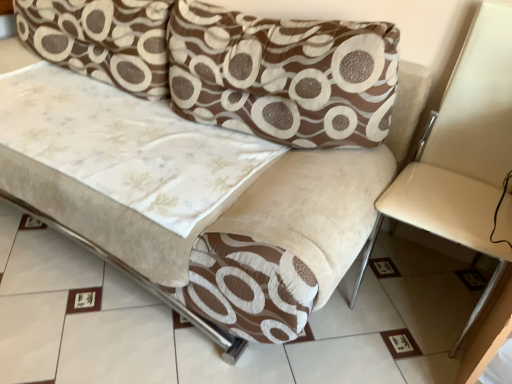
At what (x,y) coordinates should I click in order to perform the action: click on free spot below beige fabric armchair at right (from a real-world perspective). Please return your answer as a coordinate pair (x, y). This screenshot has height=384, width=512. Looking at the image, I should click on (411, 291).